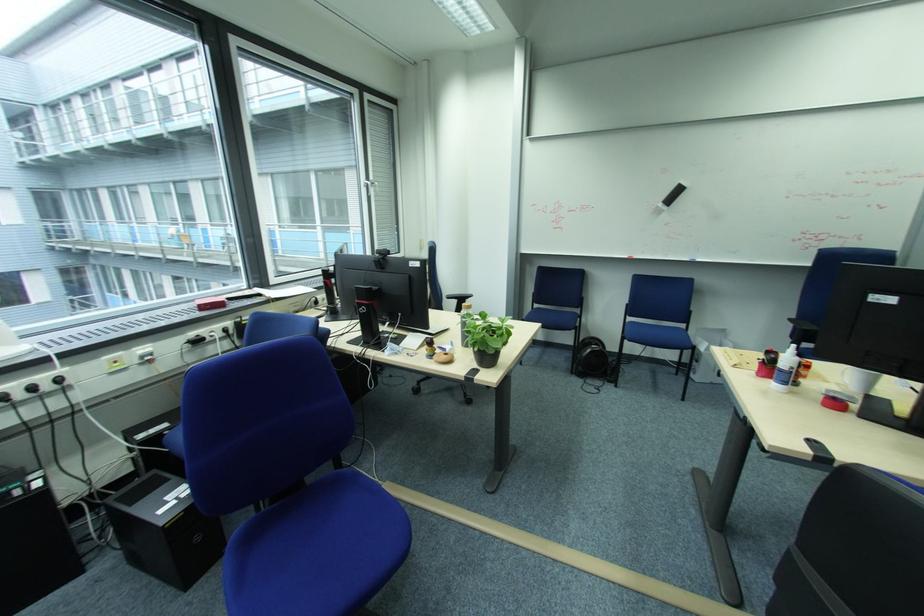
Where would you pull the white window handle? Please return your answer as a coordinate pair (x, y).

(369, 190)